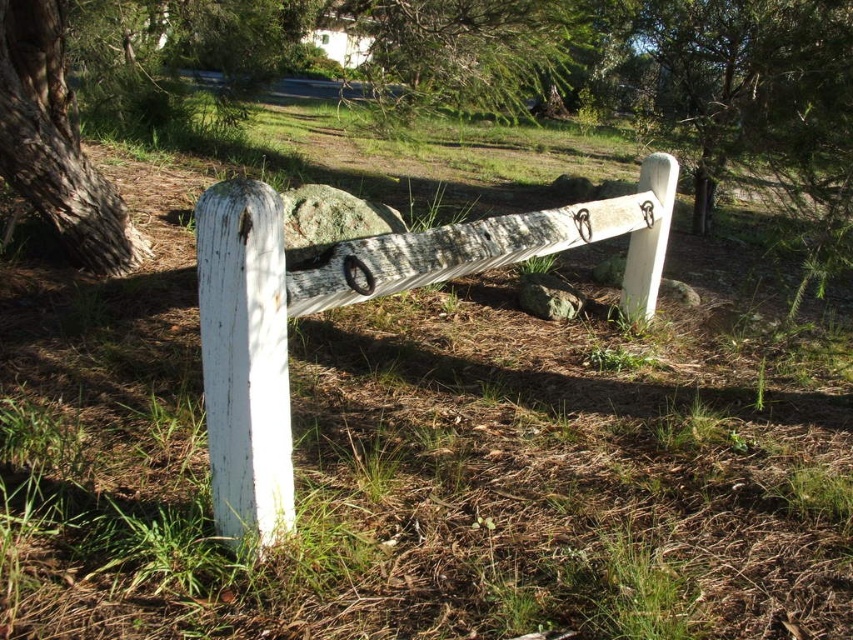
Question: Which object is positioned farthest from the green mossy rock at center?

Choices:
 (A) green textured tree at upper center
 (B) gray bark tree at left
 (C) white weathered wood post at center

Answer: (B)

Question: Does white weathered wood post at center have a larger size compared to green mossy rock at center?

Choices:
 (A) yes
 (B) no

Answer: (A)

Question: Where is gray bark tree at left located in relation to green mossy rock at center in the image?

Choices:
 (A) above
 (B) below

Answer: (A)

Question: Which point is farther to the camera?

Choices:
 (A) (276, 195)
 (B) (67, 131)
 (C) (553, 294)

Answer: (C)

Question: Is white wood tree at center positioned at the back of green textured tree at upper center?

Choices:
 (A) yes
 (B) no

Answer: (B)

Question: Among these points, which one is farthest from the camera?

Choices:
 (A) (28, 152)
 (B) (544, 317)
 (C) (556, 228)
 (D) (714, 128)

Answer: (D)